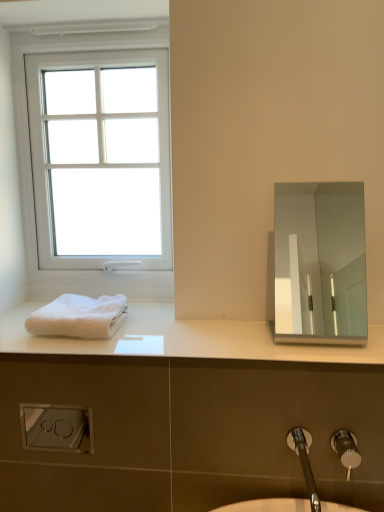
Image resolution: width=384 pixels, height=512 pixels. Identify the location of vacant area on top of white plastic window at upper left (from a real-world perspective). coord(94,25).